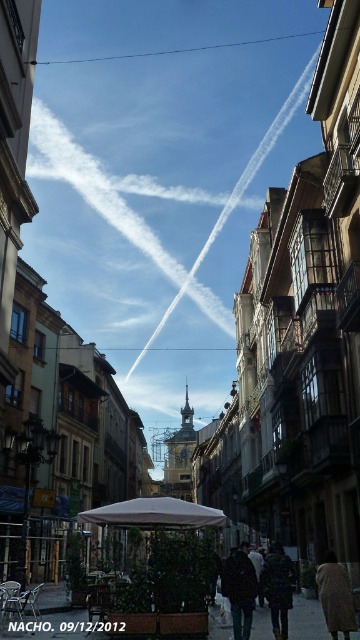
Question: Which point is farther to the camera?

Choices:
 (A) (330, 584)
 (B) (240, 556)

Answer: (B)

Question: Is dark brown leather jacket at center smaller than dark gray wool coat at center?

Choices:
 (A) no
 (B) yes

Answer: (B)

Question: Which point appears closest to the camera in this image?

Choices:
 (A) (253, 584)
 (B) (339, 614)

Answer: (B)

Question: In this image, where is dark brown leather jacket at center located relative to dark gray wool coat at center?

Choices:
 (A) left
 (B) right

Answer: (A)

Question: Which object is the farthest from the dark brown leather jacket at center?

Choices:
 (A) dark gray wool coat at center
 (B) brown fabric coat at lower right

Answer: (B)

Question: Does brown fabric coat at lower right come in front of dark gray wool coat at center?

Choices:
 (A) yes
 (B) no

Answer: (A)